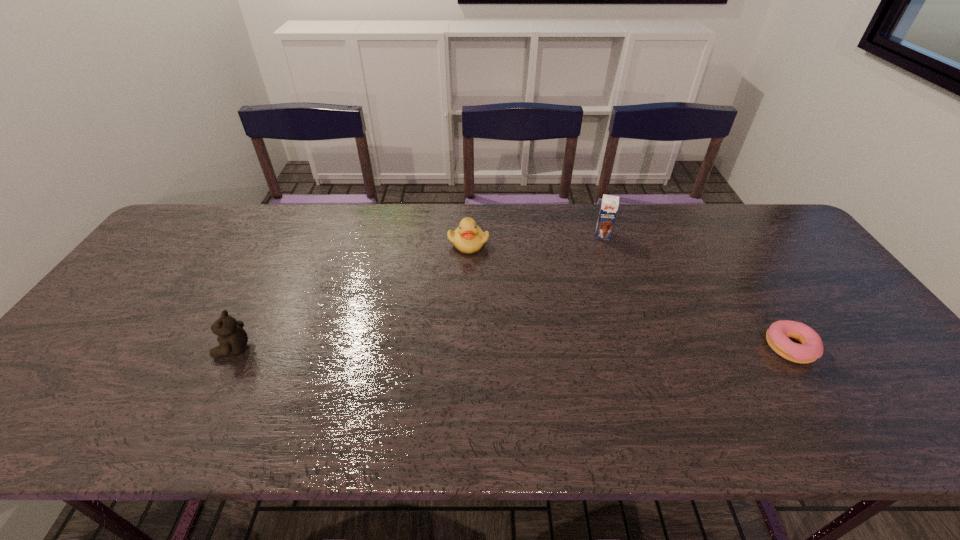
In the image, there is a desktop. Identify the location of vacant space at the far edge. (441, 225).

Where is `vacant space at the near edge of the desktop`? vacant space at the near edge of the desktop is located at coordinates (564, 372).

The height and width of the screenshot is (540, 960). In the image, there is a desktop. Identify the location of vacant space at the left edge. (158, 316).

At what (x,y) coordinates should I click in order to perform the action: click on free space at the right edge of the desktop. Please return your answer as a coordinate pair (x, y). Looking at the image, I should click on (786, 260).

What are the coordinates of `vacant space that's between the duckling and the rightmost object` in the screenshot? It's located at (630, 295).

Find the location of a particular element. The height and width of the screenshot is (540, 960). free space between the second object from right to left and the third tallest object is located at coordinates (x=536, y=239).

Identify the location of free spot between the rightmost object and the second shortest object. (630, 295).

Image resolution: width=960 pixels, height=540 pixels. In order to click on empty space that is in between the shortest object and the tallest object in this screenshot , I will do 697,292.

The height and width of the screenshot is (540, 960). What are the coordinates of `vacant space that is in between the duckling and the tallest object` in the screenshot? It's located at (536, 239).

Identify the location of free space between the teddy bear and the tallest object. (418, 292).